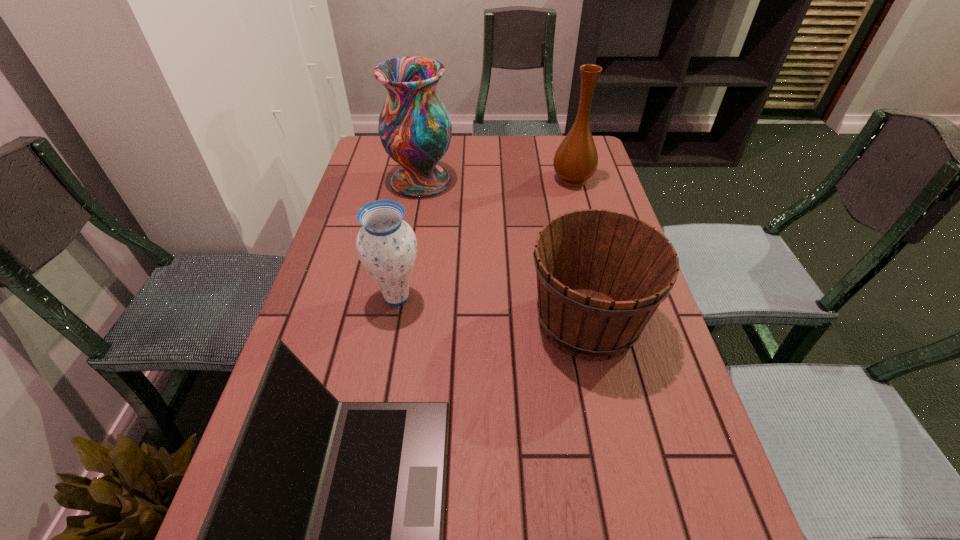
Where is `the rightmost vase`? Image resolution: width=960 pixels, height=540 pixels. the rightmost vase is located at coordinates (576, 159).

Locate an element on the screen. the shortest vase is located at coordinates (386, 245).

Identify the location of wine bucket. (601, 275).

This screenshot has height=540, width=960. Find the location of `vacant position located 0.210m on the left of the rightmost vase`. vacant position located 0.210m on the left of the rightmost vase is located at coordinates (x=487, y=179).

This screenshot has height=540, width=960. In order to click on free space located 0.310m on the right of the shortest vase in this screenshot , I will do `click(552, 297)`.

In order to click on free space located 0.250m on the front of the wine bucket in this screenshot , I will do `click(628, 502)`.

Identify the location of vase situated at the right edge. The width and height of the screenshot is (960, 540). (576, 159).

At what (x,y) coordinates should I click in order to perform the action: click on wine bucket located in the right edge section of the desktop. Please return your answer as a coordinate pair (x, y). Image resolution: width=960 pixels, height=540 pixels. Looking at the image, I should click on click(601, 275).

This screenshot has height=540, width=960. Find the location of `object located at the far left corner`. object located at the far left corner is located at coordinates (415, 129).

The height and width of the screenshot is (540, 960). I want to click on object situated at the far right corner, so click(x=576, y=159).